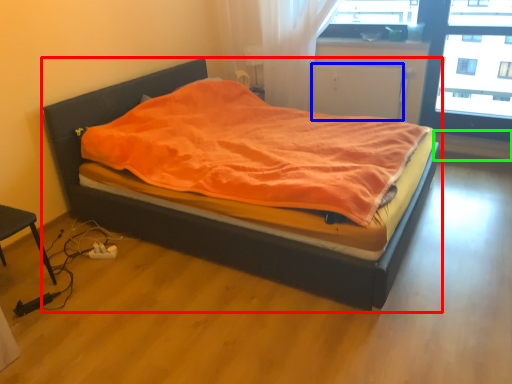
Question: Estimate the real-world distances between objects in this image. Which object is farther from bed (highlighted by a red box), screen door (highlighted by a blue box) or window sill (highlighted by a green box)?

Choices:
 (A) screen door
 (B) window sill

Answer: (B)